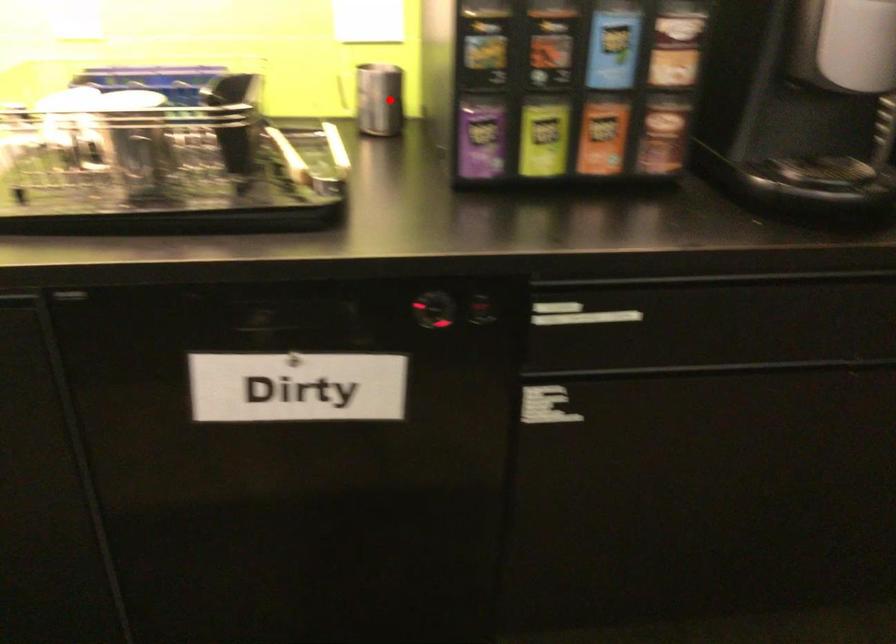
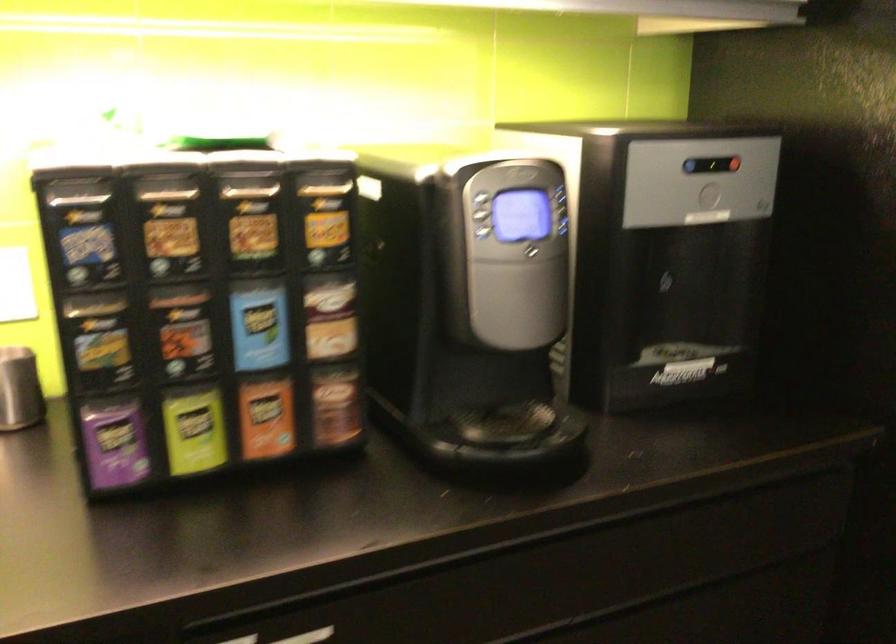
Where in the second image is the point corresponding to the highlighted location from the first image?

(19, 389)